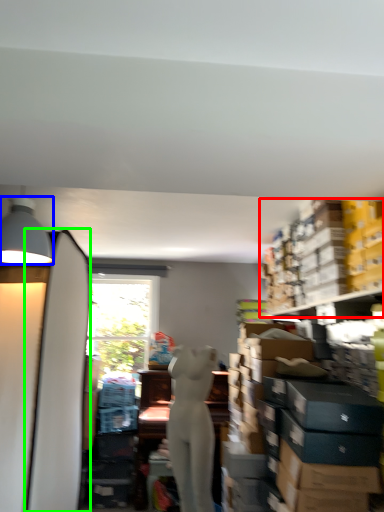
Question: Which object is positioned farthest from shelf (highlighted by a red box)? Select from lamp (highlighted by a blue box) and surfboard (highlighted by a green box).

Choices:
 (A) lamp
 (B) surfboard

Answer: (A)